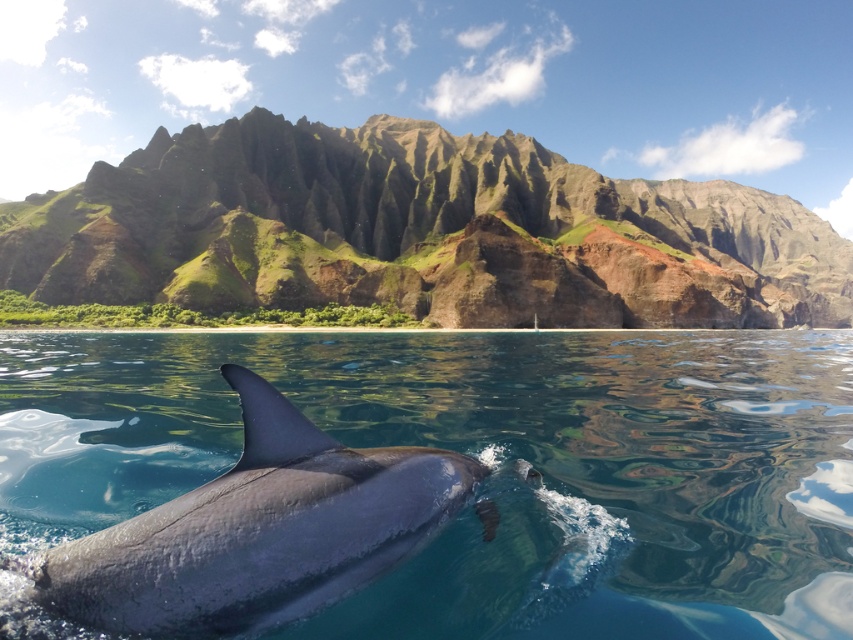
Is smooth gray dolphin at center thinner than gray matte fin at lower center?

Incorrect, smooth gray dolphin at center's width is not less than gray matte fin at lower center's.

Is point (416, 515) in front of point (279, 452)?

No, (416, 515) is further to viewer.

At what (x,y) coordinates should I click in order to perform the action: click on smooth gray dolphin at center. Please return your answer as a coordinate pair (x, y). Looking at the image, I should click on (258, 531).